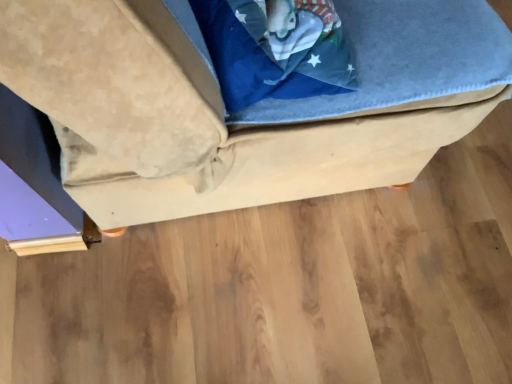
What do you see at coordinates (193, 120) in the screenshot? I see `suede-like beige ottoman at center` at bounding box center [193, 120].

I want to click on suede-like beige ottoman at center, so click(x=193, y=120).

Measure the distance between suede-like beige ottoman at center and camera.

suede-like beige ottoman at center and camera are 15.65 inches apart from each other.

This screenshot has width=512, height=384. Identify the location of wooden floor at lower center. (290, 288).

Image resolution: width=512 pixels, height=384 pixels. What do you see at coordinates (290, 288) in the screenshot?
I see `wooden floor at lower center` at bounding box center [290, 288].

Where is `suede-like beige ottoman at center`? The image size is (512, 384). suede-like beige ottoman at center is located at coordinates (193, 120).

Between suede-like beige ottoman at center and wooden floor at lower center, which one appears on the left side from the viewer's perspective?

Positioned to the left is suede-like beige ottoman at center.

Considering their positions, is suede-like beige ottoman at center located in front of or behind wooden floor at lower center?

Clearly, suede-like beige ottoman at center is in front of wooden floor at lower center.

Does point (5, 45) come farther from viewer compared to point (453, 204)?

No.

From the image's perspective, relative to wooden floor at lower center, is suede-like beige ottoman at center above or below?

suede-like beige ottoman at center is above wooden floor at lower center.

From a real-world perspective, is suede-like beige ottoman at center under wooden floor at lower center?

No, from a real-world perspective, suede-like beige ottoman at center is not below wooden floor at lower center.

Considering the sizes of objects suede-like beige ottoman at center and wooden floor at lower center in the image provided, who is thinner, suede-like beige ottoman at center or wooden floor at lower center?

With smaller width is suede-like beige ottoman at center.

Is suede-like beige ottoman at center shorter than wooden floor at lower center?

No, suede-like beige ottoman at center is not shorter than wooden floor at lower center.

Does suede-like beige ottoman at center have a larger size compared to wooden floor at lower center?

Indeed, suede-like beige ottoman at center has a larger size compared to wooden floor at lower center.

Do you think suede-like beige ottoman at center is within wooden floor at lower center, or outside of it?

suede-like beige ottoman at center exists outside the volume of wooden floor at lower center.

Are suede-like beige ottoman at center and wooden floor at lower center making contact?

No, suede-like beige ottoman at center is not next to wooden floor at lower center.

Is suede-like beige ottoman at center looking in the opposite direction of wooden floor at lower center?

No, suede-like beige ottoman at center's orientation is not away from wooden floor at lower center.

How different are the orientations of suede-like beige ottoman at center and wooden floor at lower center in degrees?

The angle between the facing direction of suede-like beige ottoman at center and the facing direction of wooden floor at lower center is 0.199 degrees.

Locate an element on the screen. The width and height of the screenshot is (512, 384). wood behind the suede-like beige ottoman at center is located at coordinates (290, 288).

Considering the relative positions of wooden floor at lower center and suede-like beige ottoman at center in the image provided, is wooden floor at lower center to the left of suede-like beige ottoman at center from the viewer's perspective?

No, wooden floor at lower center is not to the left of suede-like beige ottoman at center.

Is wooden floor at lower center in front of or behind suede-like beige ottoman at center in the image?

wooden floor at lower center is behind suede-like beige ottoman at center.

Is point (82, 283) in front of point (155, 125)?

No, it is not.

From the image's perspective, is wooden floor at lower center above suede-like beige ottoman at center?

No, from the image's perspective, wooden floor at lower center is not above suede-like beige ottoman at center.

From a real-world perspective, is wooden floor at lower center positioned over suede-like beige ottoman at center based on gravity?

No, from a real-world perspective, wooden floor at lower center is not over suede-like beige ottoman at center

Which of these two, wooden floor at lower center or suede-like beige ottoman at center, is wider?

wooden floor at lower center.

Can you confirm if wooden floor at lower center is taller than suede-like beige ottoman at center?

In fact, wooden floor at lower center may be shorter than suede-like beige ottoman at center.

Is wooden floor at lower center smaller than suede-like beige ottoman at center?

Correct, wooden floor at lower center occupies less space than suede-like beige ottoman at center.

Would you say suede-like beige ottoman at center is part of wooden floor at lower center's contents?

That's incorrect, suede-like beige ottoman at center is not inside wooden floor at lower center.

Is wooden floor at lower center in contact with suede-like beige ottoman at center?

No, wooden floor at lower center is not next to suede-like beige ottoman at center.

Is wooden floor at lower center turned away from suede-like beige ottoman at center?

wooden floor at lower center does not have its back to suede-like beige ottoman at center.

Where is `furniture that appears on the left of wooden floor at lower center`? furniture that appears on the left of wooden floor at lower center is located at coordinates (193, 120).

Locate an element on the screen. The width and height of the screenshot is (512, 384). furniture lying in front of the wooden floor at lower center is located at coordinates (193, 120).

Where is `wood on the right of suede-like beige ottoman at center`? This screenshot has height=384, width=512. wood on the right of suede-like beige ottoman at center is located at coordinates (290, 288).